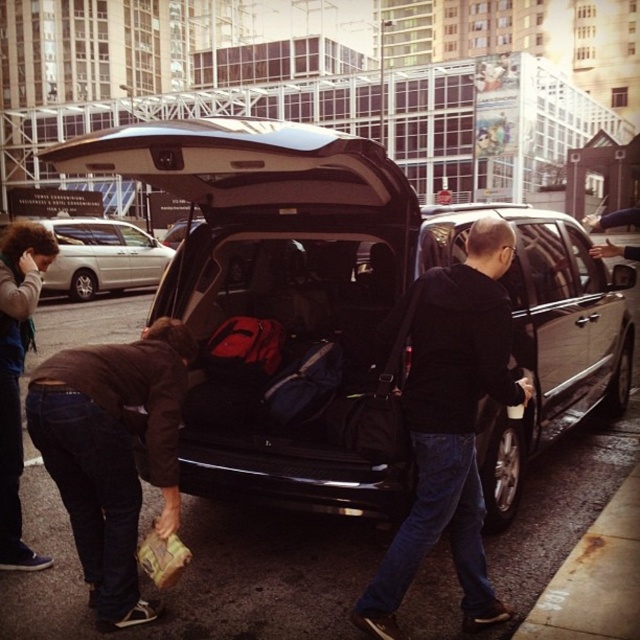
Is black leather car at center bigger than silver metallic van at center?

Actually, black leather car at center might be smaller than silver metallic van at center.

Is black leather car at center thinner than silver metallic van at center?

Incorrect, black leather car at center's width is not less than silver metallic van at center's.

Is point (67, 154) closer to camera compared to point (84, 275)?

Yes, point (67, 154) is in front of point (84, 275).

Where is `black leather car at center`? The width and height of the screenshot is (640, 640). black leather car at center is located at coordinates (369, 264).

Consider the image. Which is more to the left, brown fabric bag at lower left or dark brown leather jacket at lower left?

From the viewer's perspective, dark brown leather jacket at lower left appears more on the left side.

Does brown fabric bag at lower left appear under dark brown leather jacket at lower left?

Yes.

Is point (132, 618) closer to camera compared to point (10, 241)?

Yes, it is.

Where is `brown fabric bag at lower left`? brown fabric bag at lower left is located at coordinates (113, 452).

Who is taller, black leather jacket at center or dark brown leather jacket at lower left?

dark brown leather jacket at lower left

Can you confirm if black leather jacket at center is wider than dark brown leather jacket at lower left?

Indeed, black leather jacket at center has a greater width compared to dark brown leather jacket at lower left.

Image resolution: width=640 pixels, height=640 pixels. I want to click on black leather jacket at center, so click(451, 424).

Image resolution: width=640 pixels, height=640 pixels. Find the location of `black leather jacket at center`. black leather jacket at center is located at coordinates click(x=451, y=424).